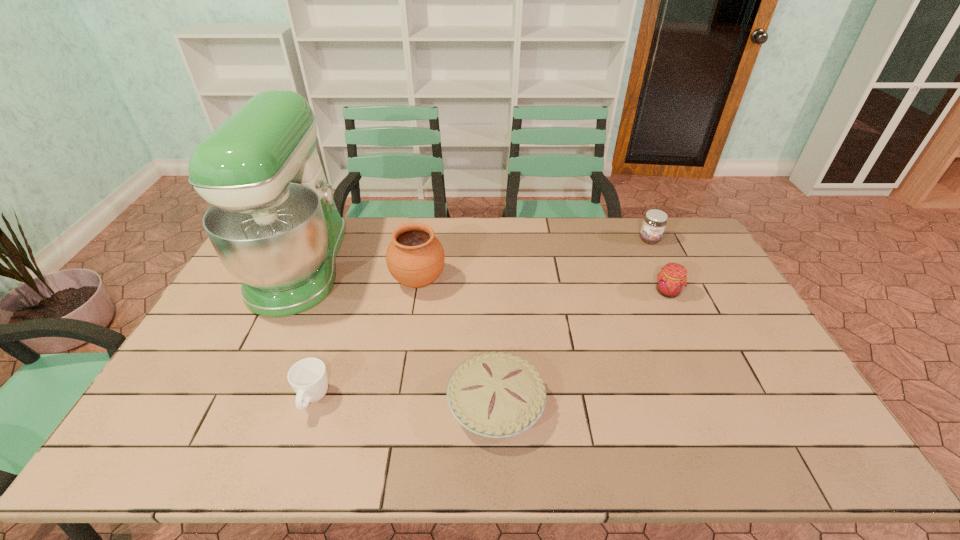
Find the location of `free point located 0.390m on the left of the shorter jam`. free point located 0.390m on the left of the shorter jam is located at coordinates (532, 292).

The width and height of the screenshot is (960, 540). What are the coordinates of `vacant space located with the handle on the side of the cup` in the screenshot? It's located at (297, 449).

Locate an element on the screen. The height and width of the screenshot is (540, 960). vacant region located on the back of the fourth object from left to right is located at coordinates (493, 320).

This screenshot has width=960, height=540. Identify the location of mixer present at the far edge. (273, 222).

Where is `jam that is at the far edge`? This screenshot has width=960, height=540. jam that is at the far edge is located at coordinates [x=654, y=223].

Find the location of a particular element. object that is at the near edge is located at coordinates (496, 395).

The image size is (960, 540). What are the coordinates of `object present at the left edge` in the screenshot? It's located at (273, 222).

I want to click on object that is at the right edge, so click(x=654, y=223).

Where is `object located at the far left corner`? Image resolution: width=960 pixels, height=540 pixels. object located at the far left corner is located at coordinates (273, 222).

Identify the location of object present at the far right corner. (654, 223).